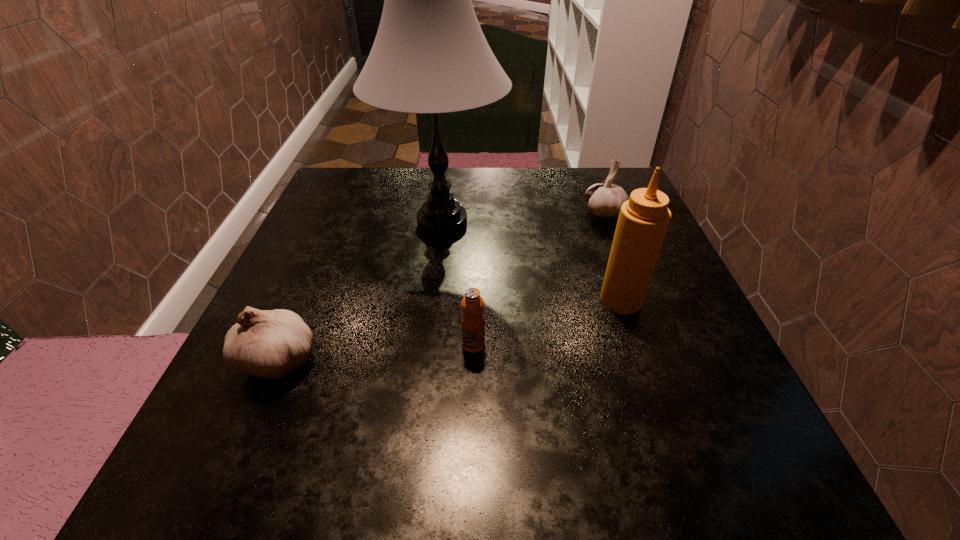
The height and width of the screenshot is (540, 960). In order to click on free region at the far edge of the desktop in this screenshot , I will do `click(482, 197)`.

Image resolution: width=960 pixels, height=540 pixels. In the image, there is a desktop. Identify the location of vacant region at the near edge. (479, 481).

Where is `vacant space at the left edge`? This screenshot has width=960, height=540. vacant space at the left edge is located at coordinates (323, 227).

In the image, there is a desktop. Where is `vacant space at the right edge`? Image resolution: width=960 pixels, height=540 pixels. vacant space at the right edge is located at coordinates (642, 316).

Locate an element on the screen. vacant space at the far left corner of the desktop is located at coordinates (339, 210).

Find the location of a particular element. Image resolution: width=960 pixels, height=540 pixels. free region at the near left corner of the desktop is located at coordinates (255, 487).

At what (x,y) coordinates should I click in order to perform the action: click on vacant area that lies between the farther garlic and the orange juice. Please return your answer as a coordinate pair (x, y). Looking at the image, I should click on (540, 279).

Locate an element on the screen. empty location between the tallest object and the orange juice is located at coordinates pyautogui.click(x=458, y=284).

The width and height of the screenshot is (960, 540). Identify the location of free spot between the lamp and the leftmost object. (360, 291).

The height and width of the screenshot is (540, 960). I want to click on free spot between the fourth shortest object and the orange juice, so click(547, 322).